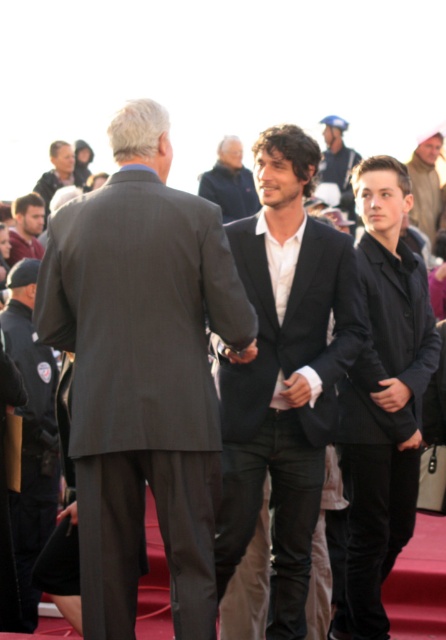
You are a photographer at the event and need to capture a photo of the dark blue uniform at left and the matte black jacket at left. Based on their positions, which one is closer to the camera?

The dark blue uniform at left is positioned under the matte black jacket at left, so the matte black jacket at left is closer to the camera.

You are a photographer at the event and need to capture a photo that includes both the dark blue jacket at center and the matte black jacket at upper left. Given their positions, which jacket should you focus on first to ensure both are in the frame?

The dark blue jacket at center is in front of the matte black jacket at upper left, so you should focus on the matte black jacket at upper left first to ensure both are visible in the frame.

You are a photographer at the event and want to capture a photo that includes both the dark blue jacket at center and the matte black jacket at upper left. Based on their positions, which jacket should you focus on first to ensure both are in the frame?

The dark blue jacket at center is positioned under the matte black jacket at upper left, so focusing on the matte black jacket at upper left first will allow you to adjust the camera angle downward to include the dark blue jacket at center in the frame.